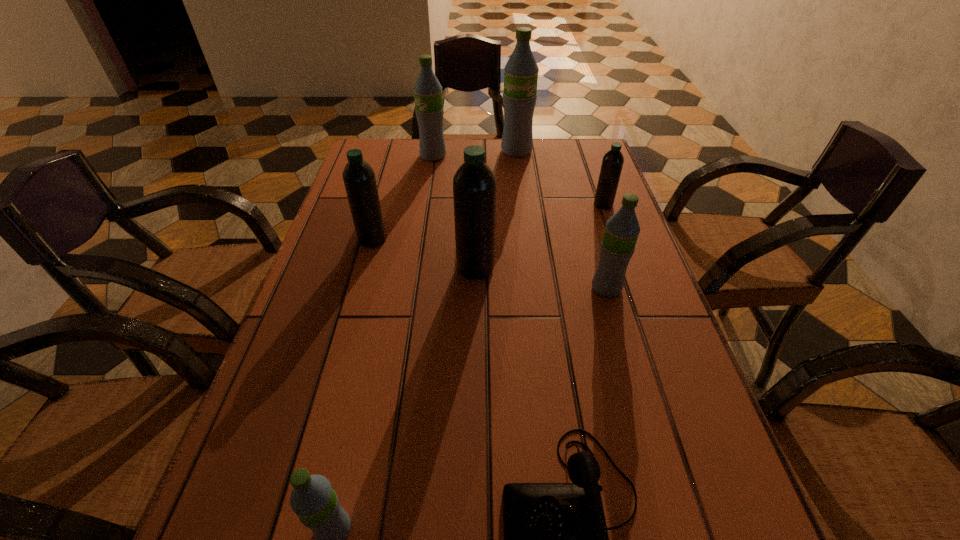
This screenshot has width=960, height=540. In the image, there is a desktop. Identify the location of vacant space at the far right corner. tap(596, 166).

You are a GUI agent. You are given a task and a screenshot of the screen. Output one action in this format:
    pyautogui.click(x=<x>, y=<y>)
    Task: Click on the free space between the third biggest green water bottle and the third smallest green water bottle
    
    Given the screenshot: What is the action you would take?
    pyautogui.click(x=519, y=222)

In order to click on vacant space that is in between the fourth farthest object and the fourth water bottle from right to left in this screenshot , I will do `click(424, 254)`.

The height and width of the screenshot is (540, 960). In order to click on vacant point located between the second farthest black water bottle and the biggest green water bottle in this screenshot , I will do `click(444, 195)`.

Identify the location of vacant area that lies between the second green water bottle from right to left and the rightmost green water bottle. The image size is (960, 540). (562, 219).

In order to click on object that can be found as the closest to the second nearest green water bottle in this screenshot , I will do `click(474, 184)`.

Identify the location of object that stands as the fifth closest to the third biggest green water bottle. (521, 71).

Identify the location of water bottle that is the sixth closest to the fifth object from right to left. (314, 501).

Select which water bottle appears as the second closest to the leftmost black water bottle. Please provide its 2D coordinates. Your answer should be formatted as a tuple, i.e. [(x, y)], where the tuple contains the x and y coordinates of a point satisfying the conditions above.

[(429, 110)]

I want to click on green water bottle that is the closest one to the fourth farthest water bottle, so click(x=429, y=110).